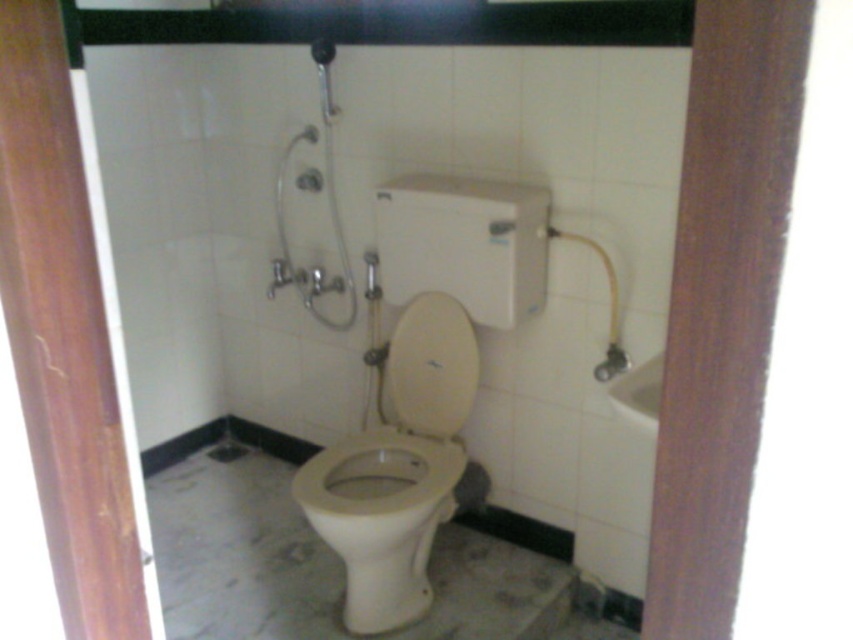
Where is `white glossy toilet seat at center`? white glossy toilet seat at center is located at coordinates (431, 365).

This screenshot has height=640, width=853. I want to click on white glossy toilet seat at center, so click(431, 365).

Looking at this image, does white glossy toilet bowl at center have a larger size compared to metallic silver shower at upper center?

Correct, white glossy toilet bowl at center is larger in size than metallic silver shower at upper center.

Does white glossy toilet bowl at center have a greater width compared to metallic silver shower at upper center?

→ Correct, the width of white glossy toilet bowl at center exceeds that of metallic silver shower at upper center.

Is point (347, 561) less distant than point (322, 92)?

Yes, point (347, 561) is closer to viewer.

Where is `white glossy toilet bowl at center`? white glossy toilet bowl at center is located at coordinates (381, 518).

Looking at this image, who is shorter, white glossy toilet at center or white glossy toilet bowl at center?

white glossy toilet bowl at center is shorter.

Which is behind, point (520, 268) or point (404, 531)?

The point (520, 268) is more distant.

Is point (436, 410) in front of point (360, 502)?

No, it is behind (360, 502).

Locate an element on the screen. This screenshot has width=853, height=640. white glossy toilet at center is located at coordinates (422, 384).